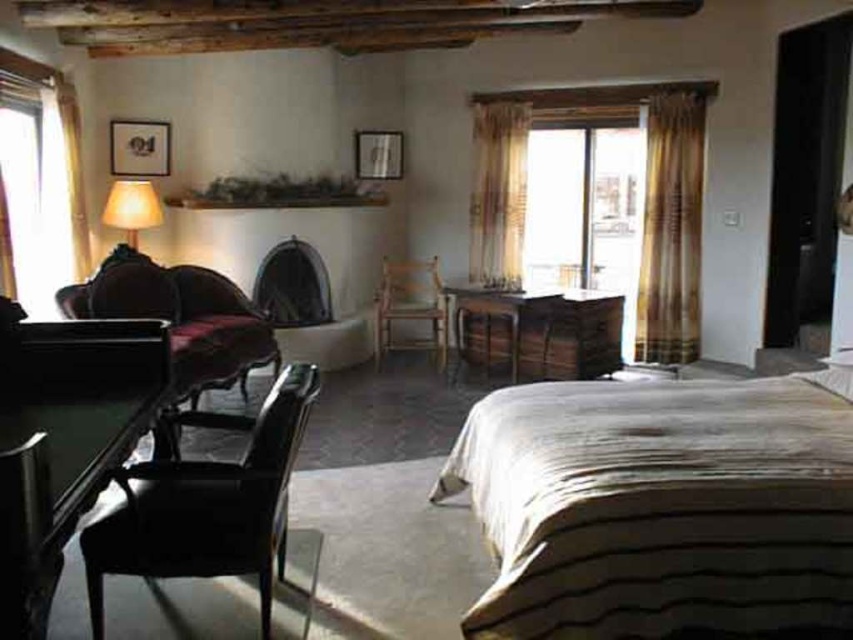
You are sitting in the room and want to place a small plant on the wooden table at center. To reach the table from the matte black armchair at lower left, do you need to move upwards or downwards?

The matte black armchair at lower left is below the wooden table at center, so to reach the table, you would need to move upwards.

You are planning to hang a new plaid fabric curtain at right in the room. The current wooden table at center is in the way. Can you move the table to the left to make space for the curtain?

The plaid fabric curtain at right is thinner than the wooden table at center, so moving the table to the left might be possible since the curtain takes up less space. However, ensure there is enough clearance between the table and other furniture.

You are a delivery person who needs to place a rectangular package that is 3.5 feet long on the floor between the plaid fabric curtain at right and the wooden table at center. Can the package fit horizontally in that space?

The distance between the plaid fabric curtain at right and the wooden table at center is 3.91 feet. Since the package is 3.5 feet long, it can fit horizontally in the space as 3.5 feet is shorter than 3.91 feet.